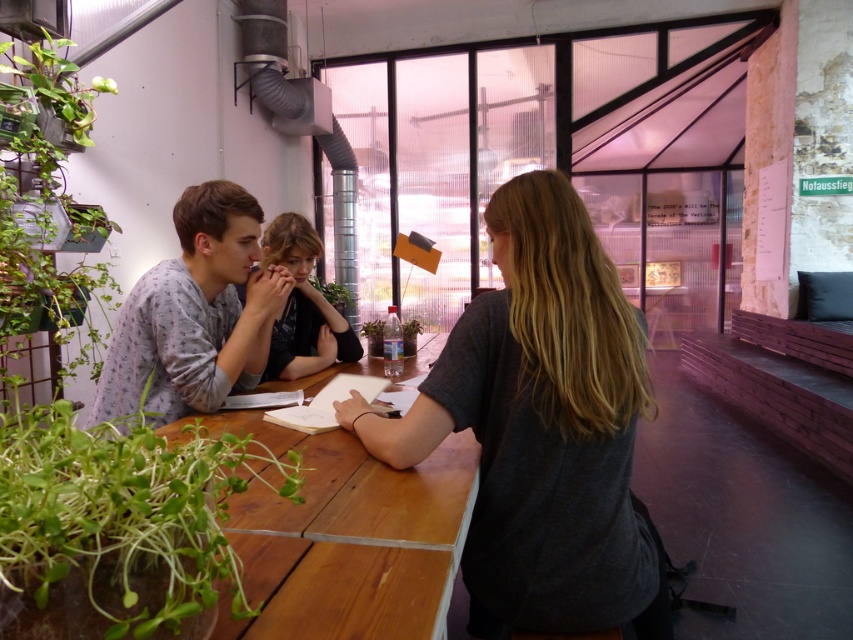
Where is `dark gray t-shirt at center`? The width and height of the screenshot is (853, 640). dark gray t-shirt at center is located at coordinates (543, 428).

From the picture: Who is shorter, dark gray t-shirt at center or matte black hair at center?

Standing shorter between the two is matte black hair at center.

Describe the element at coordinates (543, 428) in the screenshot. I see `dark gray t-shirt at center` at that location.

You are a GUI agent. You are given a task and a screenshot of the screen. Output one action in this format:
    pyautogui.click(x=<x>, y=<y>)
    Task: Click on the dark gray t-shirt at center
    The height and width of the screenshot is (640, 853).
    Given the screenshot: What is the action you would take?
    pyautogui.click(x=543, y=428)

Does matte black hair at center have a lesser height compared to green glossy pitcher plant at upper left?

In fact, matte black hair at center may be taller than green glossy pitcher plant at upper left.

Is point (351, 353) positioned after point (90, 106)?

No, it is not.

Which is in front, point (297, 362) or point (113, 92)?

Point (297, 362) is more forward.

Find the location of `matte black hair at center`. matte black hair at center is located at coordinates (302, 305).

In the scene shown: Does green leafy plant at lower left have a larger size compared to light gray pajama top at center?

No, green leafy plant at lower left is not bigger than light gray pajama top at center.

Is point (171, 515) farther from viewer compared to point (250, 200)?

No, (171, 515) is closer to viewer.

At what (x,y) coordinates should I click in order to perform the action: click on green leafy plant at lower left. Please return your answer as a coordinate pair (x, y). Looking at the image, I should click on (117, 528).